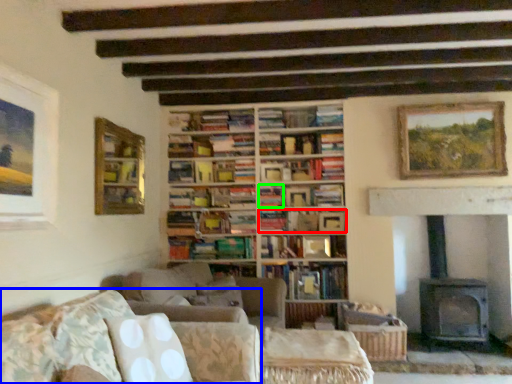
Question: Which object is positioned closest to book (highlighted by a red box)? Select from studio couch (highlighted by a blue box) and book (highlighted by a green box).

Choices:
 (A) studio couch
 (B) book

Answer: (B)